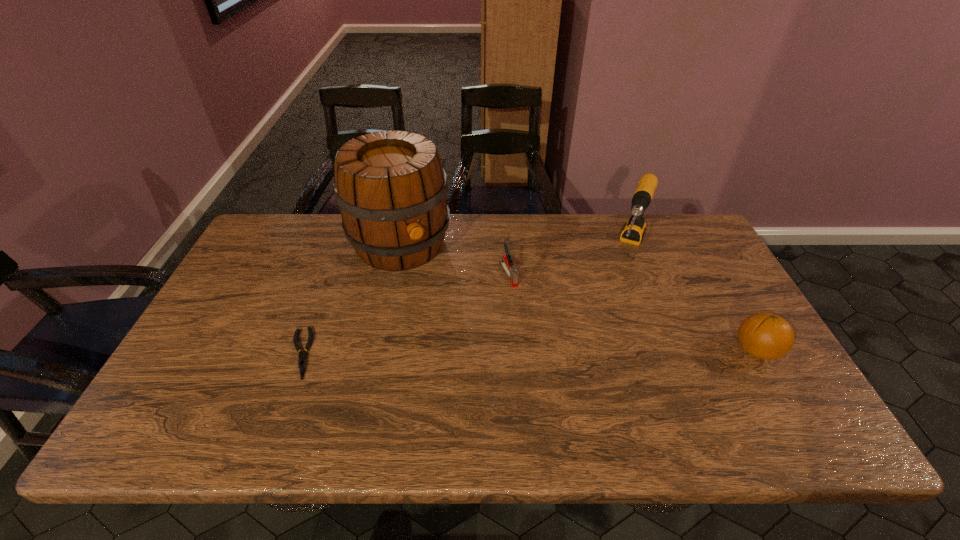
This screenshot has width=960, height=540. I want to click on object located in the right edge section of the desktop, so click(767, 336).

The image size is (960, 540). In the image, there is a desktop. What are the coordinates of `free space at the far edge` in the screenshot? It's located at (537, 245).

In order to click on free space at the near edge in this screenshot , I will do (x=272, y=384).

Where is `free space at the left edge of the desktop`? free space at the left edge of the desktop is located at coordinates (270, 305).

In the image, there is a desktop. Identify the location of vacant space at the right edge. The height and width of the screenshot is (540, 960). (691, 263).

You are a GUI agent. You are given a task and a screenshot of the screen. Output one action in this format:
    pyautogui.click(x=<x>, y=<y>)
    Task: Click on the free region at the far left corner of the desktop
    The width and height of the screenshot is (960, 540).
    Given the screenshot: What is the action you would take?
    pyautogui.click(x=261, y=252)

This screenshot has width=960, height=540. Identify the location of vacant space at the near left corner of the desktop. (231, 388).

Identify the location of free location at the far right corner of the desktop. Image resolution: width=960 pixels, height=540 pixels. (676, 214).

Where is `vacant position at the near right corner of the desktop`? This screenshot has width=960, height=540. vacant position at the near right corner of the desktop is located at coordinates (732, 394).

Identify the location of free area in between the second tallest object and the stapler. (569, 261).